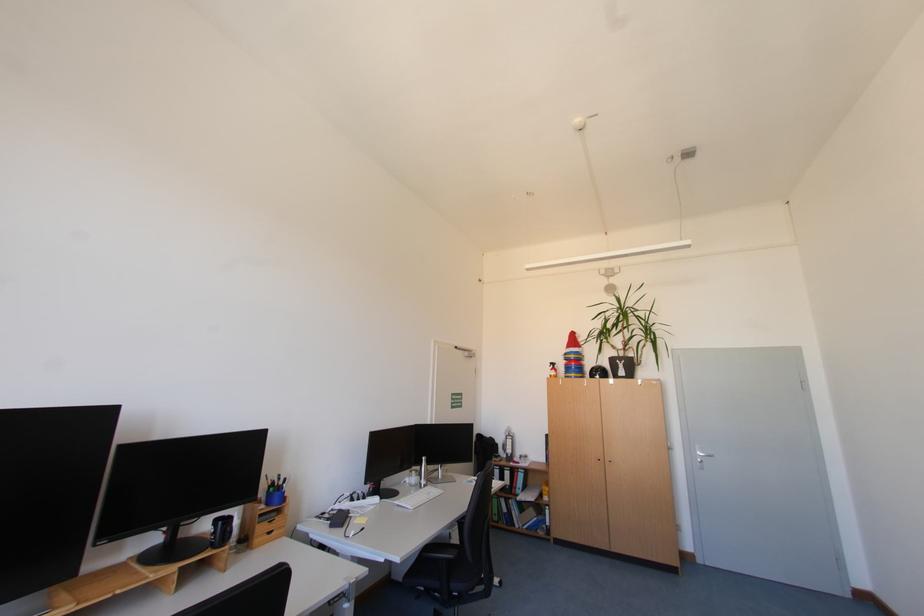
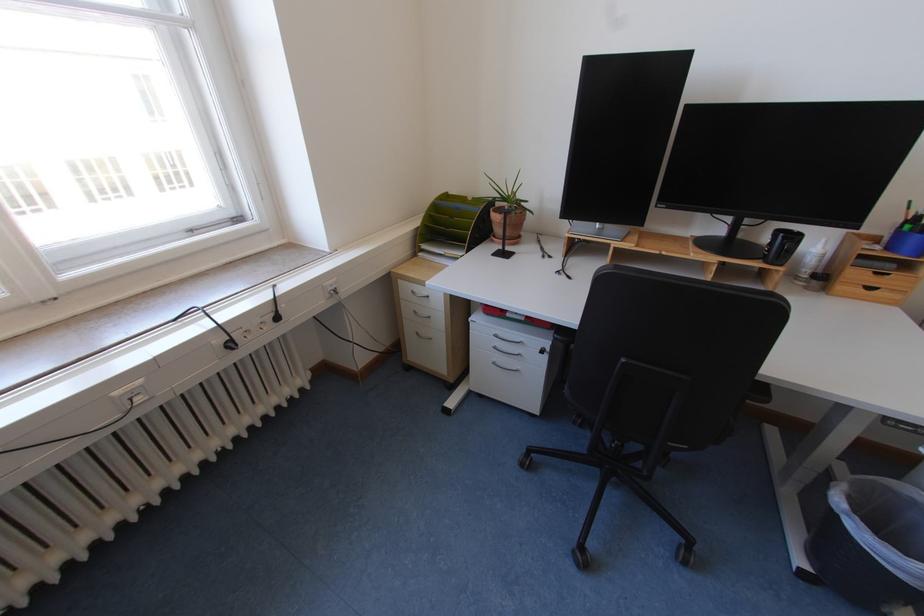
Locate, in the second image, the point that corresponds to [263,536] in the first image.

(848, 281)